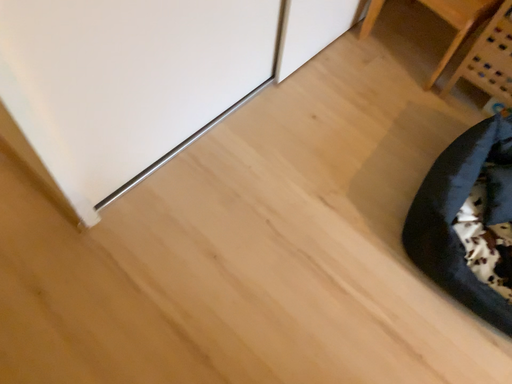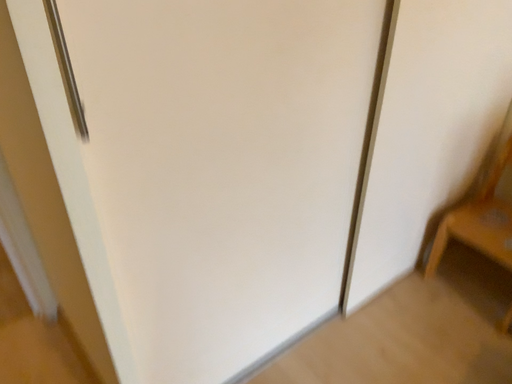
Question: How did the camera likely rotate when shooting the video?

Choices:
 (A) rotated downward
 (B) rotated upward

Answer: (B)